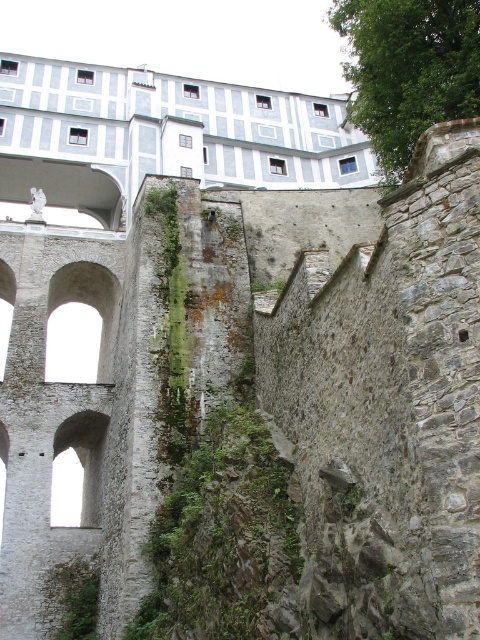
Question: Is the position of green mossy wall at center less distant than that of green leafy tree at upper right?

Choices:
 (A) yes
 (B) no

Answer: (A)

Question: Which of the following is the farthest from the observer?

Choices:
 (A) (182, 628)
 (B) (382, 20)

Answer: (B)

Question: Can you confirm if green mossy wall at center is positioned above green leafy tree at upper right?

Choices:
 (A) no
 (B) yes

Answer: (A)

Question: Among these points, which one is farthest from the camera?

Choices:
 (A) (215, 621)
 (B) (340, 12)

Answer: (B)

Question: Is green mossy wall at center closer to camera compared to green leafy tree at upper right?

Choices:
 (A) no
 (B) yes

Answer: (B)

Question: Which point is closer to the camera taking this photo?

Choices:
 (A) (396, 177)
 (B) (275, 604)

Answer: (B)